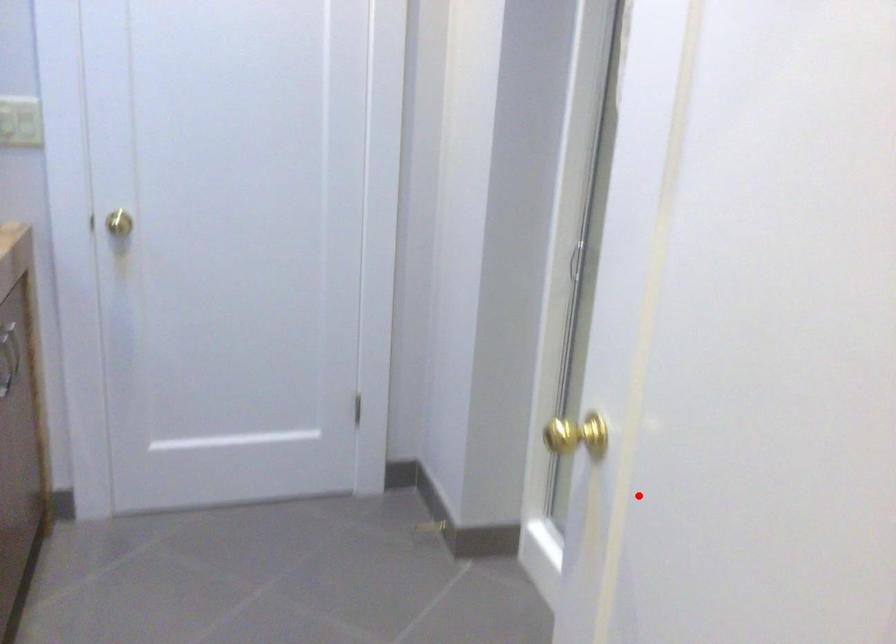
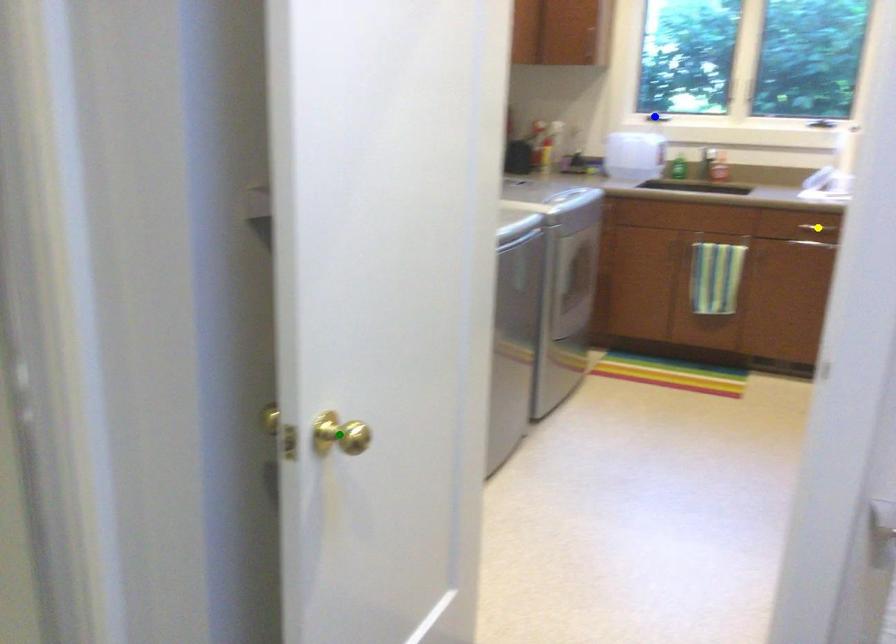
Question: I am providing you with two images of the same scene from different viewpoints. A red point is marked on the first image. You are given multiple points on the second image. Which point in image 2 represents the same 3d spot as the red point in image 1?

Choices:
 (A) green point
 (B) blue point
 (C) yellow point

Answer: (A)